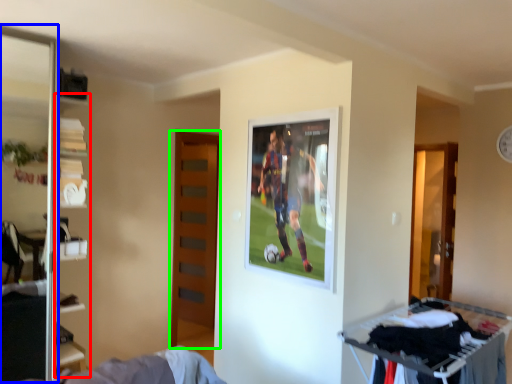
Question: Considering the real-world distances, which object is closest to bookshelf (highlighted by a red box)? screen door (highlighted by a blue box) or door (highlighted by a green box).

Choices:
 (A) screen door
 (B) door

Answer: (A)